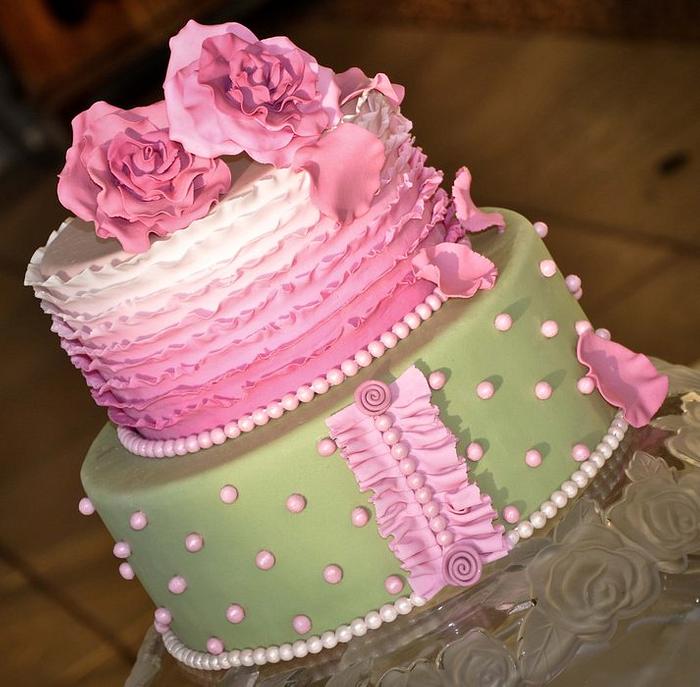
Locate an element on the screen. This screenshot has width=700, height=687. pink pearl decor is located at coordinates (486, 387).